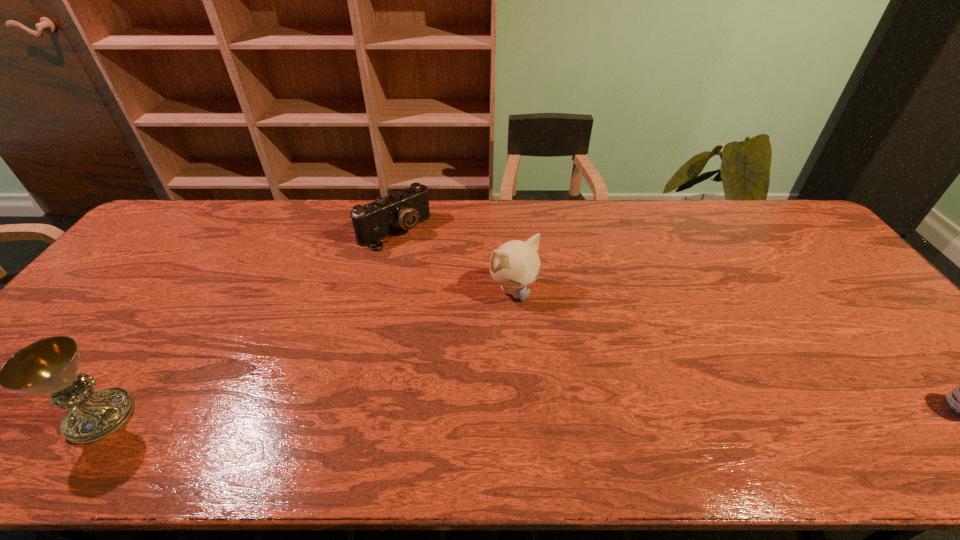
Where is `chalice`? This screenshot has width=960, height=540. chalice is located at coordinates (49, 366).

Locate an element on the screen. the third shortest object is located at coordinates (515, 264).

Locate an element on the screen. This screenshot has width=960, height=540. the second object from right to left is located at coordinates (515, 264).

You are a GUI agent. You are given a task and a screenshot of the screen. Output one action in this format:
    pyautogui.click(x=<x>, y=<y>)
    Task: Click on the camera
    
    Given the screenshot: What is the action you would take?
    tap(402, 210)

Identify the location of the farthest object. The image size is (960, 540). (402, 210).

The width and height of the screenshot is (960, 540). Identify the location of free space located on the right of the leftmost object. (212, 416).

Locate an element on the screen. Image resolution: width=960 pixels, height=540 pixels. free space located on the face of the second tallest object is located at coordinates (552, 332).

Find the location of `vacant area situated 0.250m on the face of the second tallest object`. vacant area situated 0.250m on the face of the second tallest object is located at coordinates (588, 370).

You are a GUI agent. You are given a task and a screenshot of the screen. Output one action in this format:
    pyautogui.click(x=<x>, y=<y>)
    Task: Click on the free space located on the face of the second tallest object
    
    Given the screenshot: What is the action you would take?
    pyautogui.click(x=620, y=404)

The width and height of the screenshot is (960, 540). What are the coordinates of `free spot located on the front-facing side of the farthest object` in the screenshot? It's located at (421, 255).